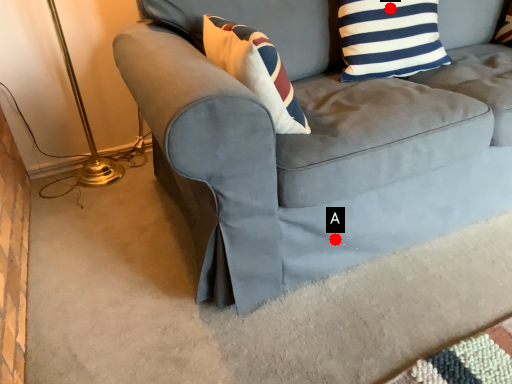
Question: Two points are circled on the image, labeled by A and B beside each circle. Which point is farther from the camera taking this photo?

Choices:
 (A) A is further
 (B) B is further

Answer: (B)